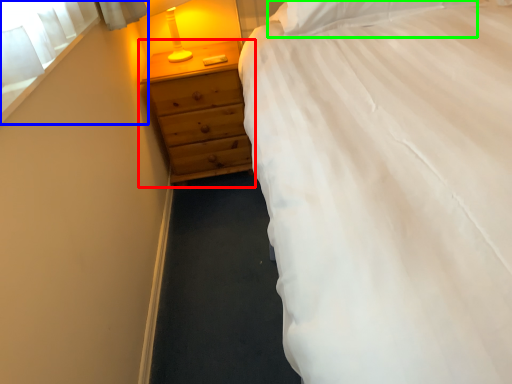
Question: Which is nearer to the chest of drawers (highlighted by a red box)? window screen (highlighted by a blue box) or pillow (highlighted by a green box).

Choices:
 (A) window screen
 (B) pillow

Answer: (B)